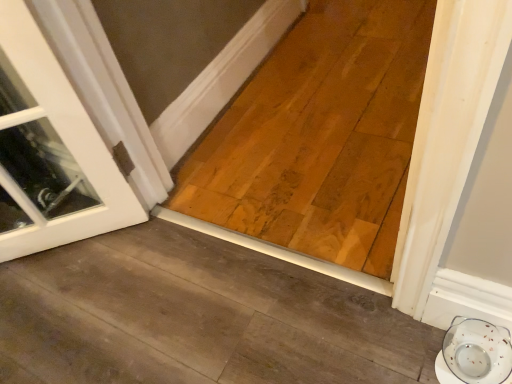
Question: Considering the positions of natural wood plank at center and white glossy saucer at lower right in the image, is natural wood plank at center bigger or smaller than white glossy saucer at lower right?

Choices:
 (A) big
 (B) small

Answer: (A)

Question: In terms of height, does natural wood plank at center look taller or shorter compared to white glossy saucer at lower right?

Choices:
 (A) short
 (B) tall

Answer: (A)

Question: Is natural wood plank at center inside or outside of white glossy saucer at lower right?

Choices:
 (A) inside
 (B) outside

Answer: (B)

Question: In the image, is white glossy saucer at lower right on the left side or the right side of natural wood plank at center?

Choices:
 (A) left
 (B) right

Answer: (B)

Question: Is white glossy saucer at lower right spatially inside natural wood plank at center, or outside of it?

Choices:
 (A) inside
 (B) outside

Answer: (B)

Question: Is point (477, 365) positioned closer to the camera than point (352, 132)?

Choices:
 (A) farther
 (B) closer

Answer: (B)

Question: Is white glossy saucer at lower right wider or thinner than natural wood plank at center?

Choices:
 (A) wide
 (B) thin

Answer: (B)